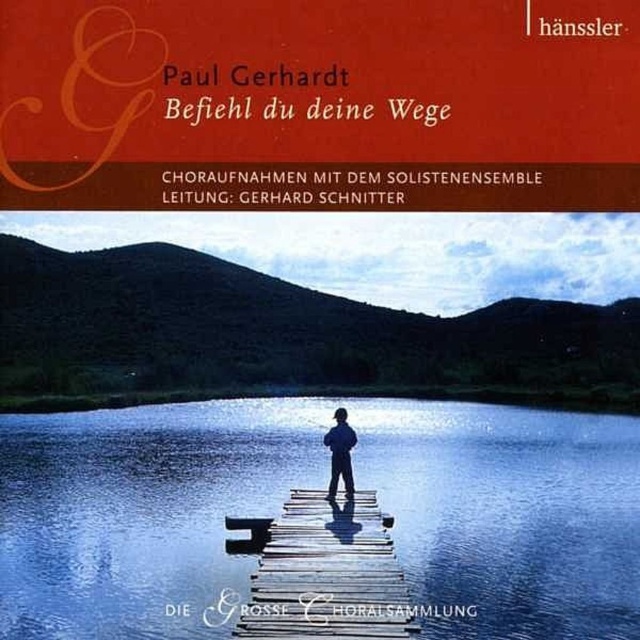
Can you confirm if wooden at center is positioned to the left of blue fabric person at center?

Indeed, wooden at center is positioned on the left side of blue fabric person at center.

At what (x,y) coordinates should I click in order to perform the action: click on wooden at center. Please return your answer as a coordinate pair (x, y). This screenshot has width=640, height=640. Looking at the image, I should click on (326, 573).

Can you confirm if matte orange book cover at upper center is wider than blue reflective water at center?

Incorrect, matte orange book cover at upper center's width does not surpass blue reflective water at center's.

Image resolution: width=640 pixels, height=640 pixels. Identify the location of matte orange book cover at upper center. (320, 104).

Is blue reflective water at center further to camera compared to blue fabric person at center?

No, blue reflective water at center is closer to the viewer.

Can you confirm if blue reflective water at center is shorter than blue fabric person at center?

In fact, blue reflective water at center may be taller than blue fabric person at center.

Identify the location of blue reflective water at center. point(141,512).